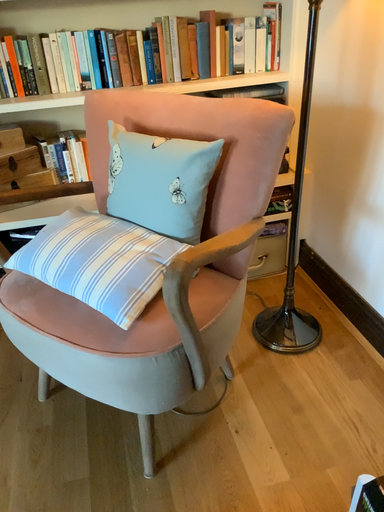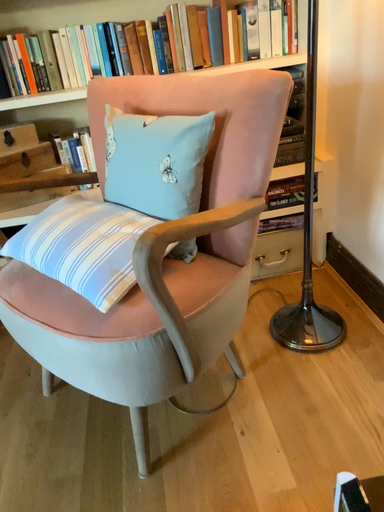
Question: How did the camera likely rotate when shooting the video?

Choices:
 (A) rotated right
 (B) rotated left

Answer: (B)